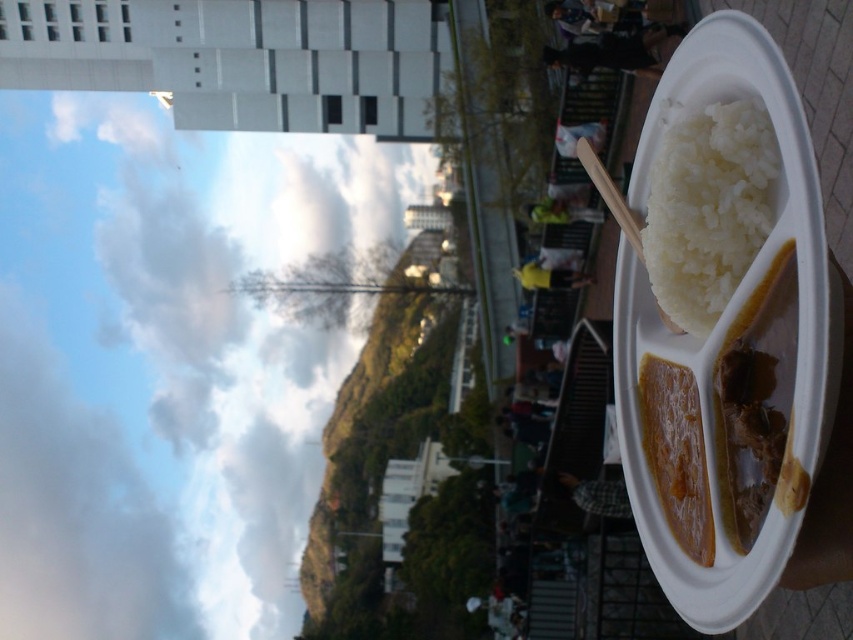
You are a delivery person holding a package that is 1 meter long. You need to place it between the yellow fabric at center and the white matte person at center. Is there enough space between them to fit the package?

The yellow fabric at center and the white matte person at center are 1.14 meters apart, so yes, the package can fit between them since the distance is greater than the package length.

You are a fashion designer observing the image. You notice the plaid fabric shirt at center and the yellow fabric at center. Which fabric is positioned lower in the image?

The plaid fabric shirt at center is positioned below the yellow fabric at center, so it is lower in the image.